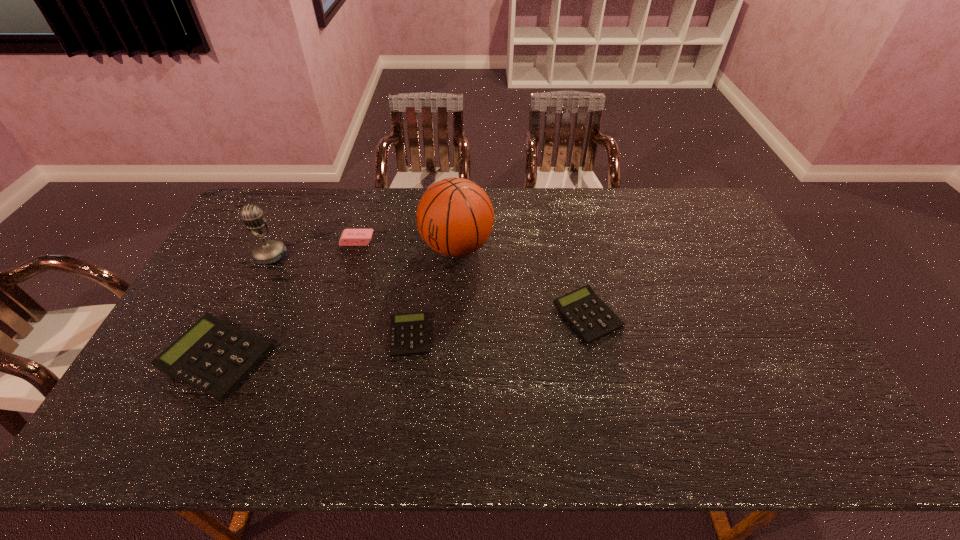
At what (x,y) coordinates should I click in order to perform the action: click on vacant space that satisfies the following two spatial constraints: 1. on the front side of the third object from left to right; 2. on the right side of the rightmost calculator. Please return your answer as a coordinate pair (x, y). The width and height of the screenshot is (960, 540). Looking at the image, I should click on (335, 315).

Where is `free space that satisfies the following two spatial constraints: 1. on the front-facing side of the microphone; 2. on the left side of the rightmost object`? The image size is (960, 540). free space that satisfies the following two spatial constraints: 1. on the front-facing side of the microphone; 2. on the left side of the rightmost object is located at coordinates (242, 315).

The image size is (960, 540). In order to click on vacant space that satisfies the following two spatial constraints: 1. on the front-facing side of the second shortest calculator; 2. on the right side of the microphone in this screenshot , I will do `click(242, 315)`.